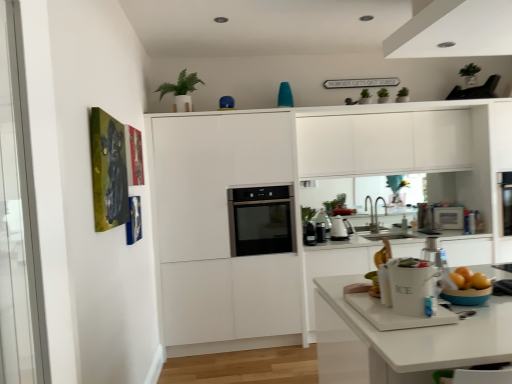
Question: From the image's perspective, would you say green matte plant at upper center is positioned over black glass oven at center?

Choices:
 (A) yes
 (B) no

Answer: (A)

Question: Is green matte plant at upper center at the left side of black glass oven at center?

Choices:
 (A) yes
 (B) no

Answer: (A)

Question: Does green matte plant at upper center appear on the right side of black glass oven at center?

Choices:
 (A) no
 (B) yes

Answer: (A)

Question: From a real-world perspective, is green matte plant at upper center physically above black glass oven at center?

Choices:
 (A) no
 (B) yes

Answer: (B)

Question: From the image's perspective, is green matte plant at upper center beneath black glass oven at center?

Choices:
 (A) no
 (B) yes

Answer: (A)

Question: Are green matte plant at upper center and black glass oven at center located far from each other?

Choices:
 (A) yes
 (B) no

Answer: (A)

Question: From the image's perspective, does green matte plant at upper center appear higher than silver metallic faucet at center?

Choices:
 (A) yes
 (B) no

Answer: (A)

Question: Can you confirm if green matte plant at upper center is wider than silver metallic faucet at center?

Choices:
 (A) no
 (B) yes

Answer: (B)

Question: Is green matte plant at upper center completely or partially outside of silver metallic faucet at center?

Choices:
 (A) no
 (B) yes

Answer: (B)

Question: From a real-world perspective, does green matte plant at upper center stand above silver metallic faucet at center?

Choices:
 (A) yes
 (B) no

Answer: (A)

Question: From the image's perspective, is green matte plant at upper center below silver metallic faucet at center?

Choices:
 (A) no
 (B) yes

Answer: (A)

Question: Is green matte plant at upper center positioned with its back to silver metallic faucet at center?

Choices:
 (A) yes
 (B) no

Answer: (B)

Question: Can you confirm if silver metallic faucet at center is thinner than white ceramic ice bucket at lower center?

Choices:
 (A) yes
 (B) no

Answer: (B)